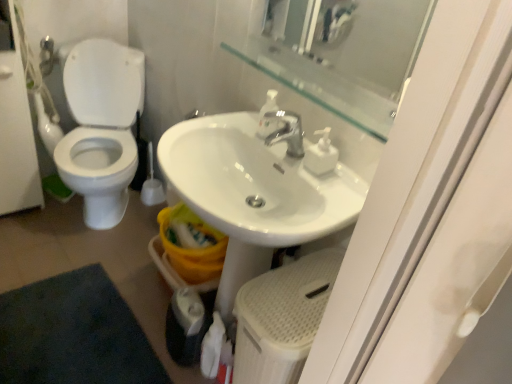
Question: Does white textured step stool at lower center have a greater height compared to white glossy sink at center?

Choices:
 (A) yes
 (B) no

Answer: (A)

Question: Is white glossy sink at center completely or partially inside white textured step stool at lower center?

Choices:
 (A) yes
 (B) no

Answer: (B)

Question: Does white textured step stool at lower center have a larger size compared to white glossy sink at center?

Choices:
 (A) yes
 (B) no

Answer: (A)

Question: Is white textured step stool at lower center to the left of white glossy sink at center from the viewer's perspective?

Choices:
 (A) yes
 (B) no

Answer: (B)

Question: Is white textured step stool at lower center aimed at white glossy sink at center?

Choices:
 (A) yes
 (B) no

Answer: (B)

Question: Is white textured step stool at lower center outside white glossy sink at center?

Choices:
 (A) no
 (B) yes

Answer: (B)

Question: Considering the relative sizes of transparent glass mirror at upper center and white glossy screen door at left in the image provided, is transparent glass mirror at upper center bigger than white glossy screen door at left?

Choices:
 (A) yes
 (B) no

Answer: (B)

Question: Considering the relative sizes of transparent glass mirror at upper center and white glossy screen door at left in the image provided, is transparent glass mirror at upper center taller than white glossy screen door at left?

Choices:
 (A) yes
 (B) no

Answer: (B)

Question: Is transparent glass mirror at upper center to the right of white glossy screen door at left from the viewer's perspective?

Choices:
 (A) yes
 (B) no

Answer: (A)

Question: From the image's perspective, would you say transparent glass mirror at upper center is shown under white glossy screen door at left?

Choices:
 (A) no
 (B) yes

Answer: (B)

Question: Is transparent glass mirror at upper center to the left of white glossy screen door at left from the viewer's perspective?

Choices:
 (A) no
 (B) yes

Answer: (A)

Question: Does transparent glass mirror at upper center have a lesser width compared to white glossy screen door at left?

Choices:
 (A) no
 (B) yes

Answer: (B)

Question: Considering the relative positions of white glossy screen door at left and white matte toilet paper at lower center in the image provided, is white glossy screen door at left to the left of white matte toilet paper at lower center from the viewer's perspective?

Choices:
 (A) no
 (B) yes

Answer: (B)